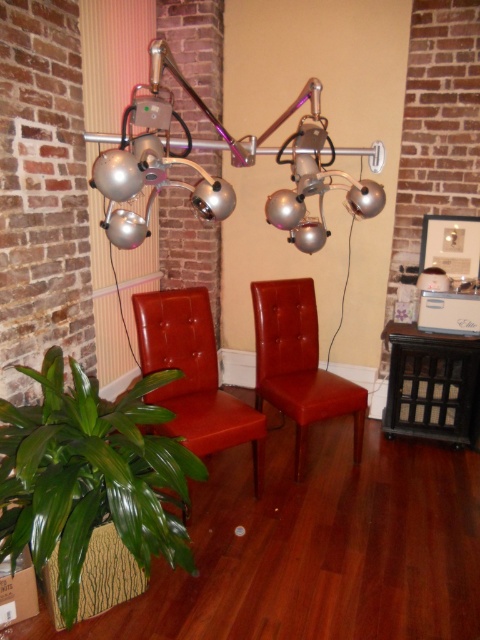
You are standing in the room and want to place a small table between the two points labeled point (320, 200) and point (305, 356). Based on their positions, which point should the table be closer to if it needs to be placed in front of both?

The table should be placed closer to point (305, 356) because point (320, 200) is in front of point (305, 356), meaning the latter is further back. Placing the table closer to the back point ensures it is in front of both points.

You are a furniture designer planning to install a new table between the metallic silver lamp at upper center and the leather at center. If the table needs to be 1 meter long to accommodate a coffee table, will there be enough space between them?

The distance between the metallic silver lamp at upper center and the leather at center is 80.47 centimeters. Since 80.47 cm is less than 1 meter, the space is insufficient for a 1 meter long table.

You are standing in the room and want to reach the metallic silver lamp at upper center. Considering your height is 1.7 meters, can you touch the lamp without any assistance?

The metallic silver lamp at upper center is 1.82 meters away from the camera. Since your height is 1.7 meters, you would need to jump or use a stool to reach it.